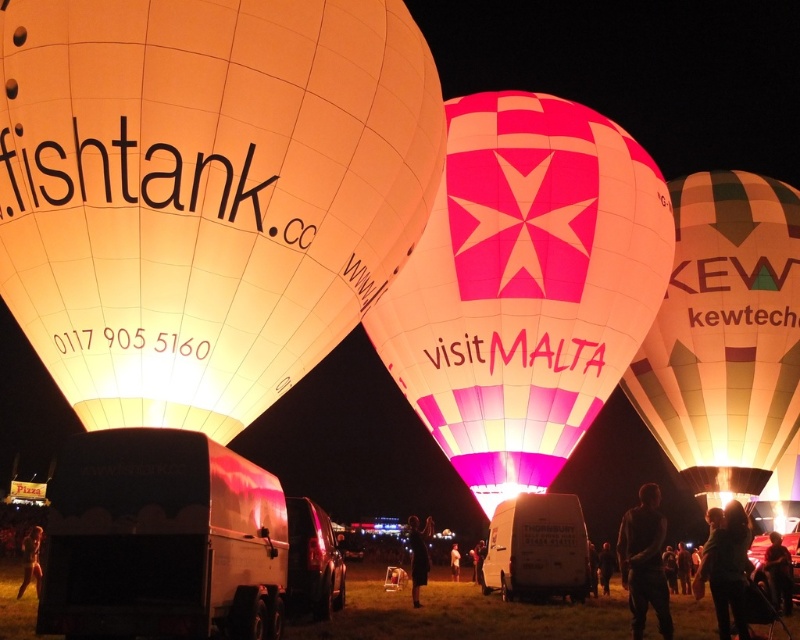
Question: Is black fabric dress at center thinner than skinny jeans at lower left?

Choices:
 (A) yes
 (B) no

Answer: (A)

Question: Which point is farther from the camera taking this photo?

Choices:
 (A) (764, 564)
 (B) (26, 563)

Answer: (B)

Question: Which object appears farthest from the camera in this image?

Choices:
 (A) red shirt at lower right
 (B) matte white balloon at upper left

Answer: (A)

Question: Among these objects, which one is nearest to the camera?

Choices:
 (A) pink/white checkered hot air balloon at center
 (B) light brown leather jacket at center
 (C) red shirt at lower right

Answer: (A)

Question: Can you confirm if pink/white checkered hot air balloon at center is wider than dark hair at lower center?

Choices:
 (A) no
 (B) yes

Answer: (B)

Question: Can you confirm if dark hair at lower center is positioned to the left of light brown leather jacket at center?

Choices:
 (A) yes
 (B) no

Answer: (B)